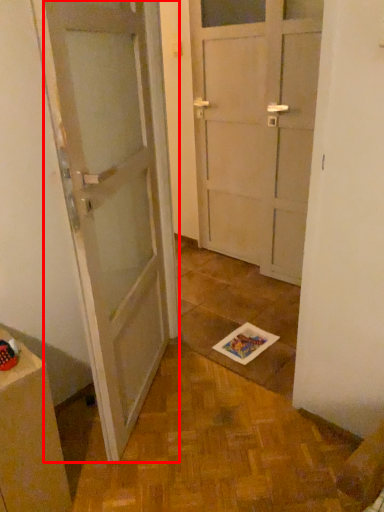
Question: From the image's perspective, considering the relative positions of door (annotated by the red box) and cabinetry in the image provided, where is door (annotated by the red box) located with respect to the staircase?

Choices:
 (A) above
 (B) below

Answer: (A)